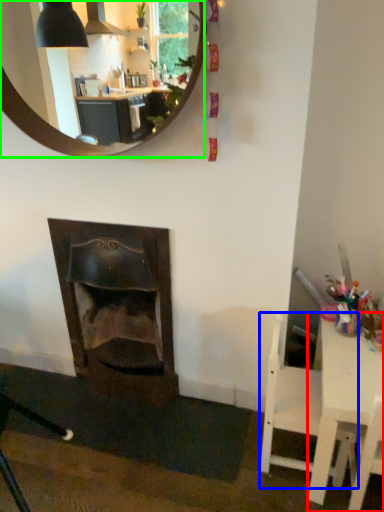
Question: Based on their relative distances, which object is farther from table (highlighted by a red box)? Choose from chair (highlighted by a blue box) and mirror (highlighted by a green box).

Choices:
 (A) chair
 (B) mirror

Answer: (B)